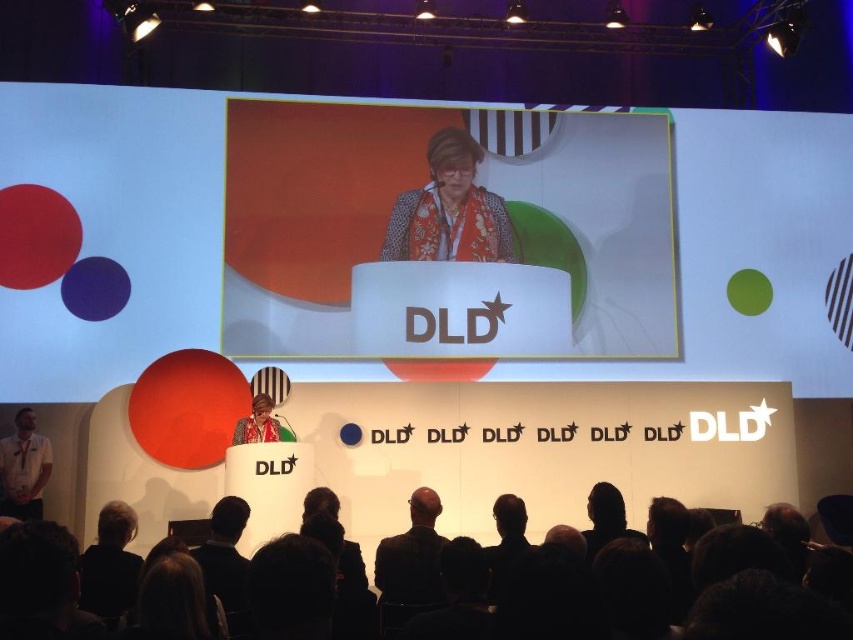
You are organizing a photo shoot and need to arrange two models wearing the black suit at center and white shirt at lower left. Based on their heights, which model should stand in front to ensure both are visible in the photo?

The black suit at center should stand in front because it is shorter than the white shirt at lower left, allowing both to be visible in the photo.

In the scene shown: You are at a conference and need to move from your current position to the speaker. The speaker is standing at point (410, 256). There is an obstacle at point (389, 564). Can you safely walk directly to the speaker without passing through the obstacle?

Point (410, 256) is behind point (389, 564), so the obstacle at point (389, 564) is between you and the speaker. Therefore, you cannot walk directly to the speaker without passing through the obstacle.